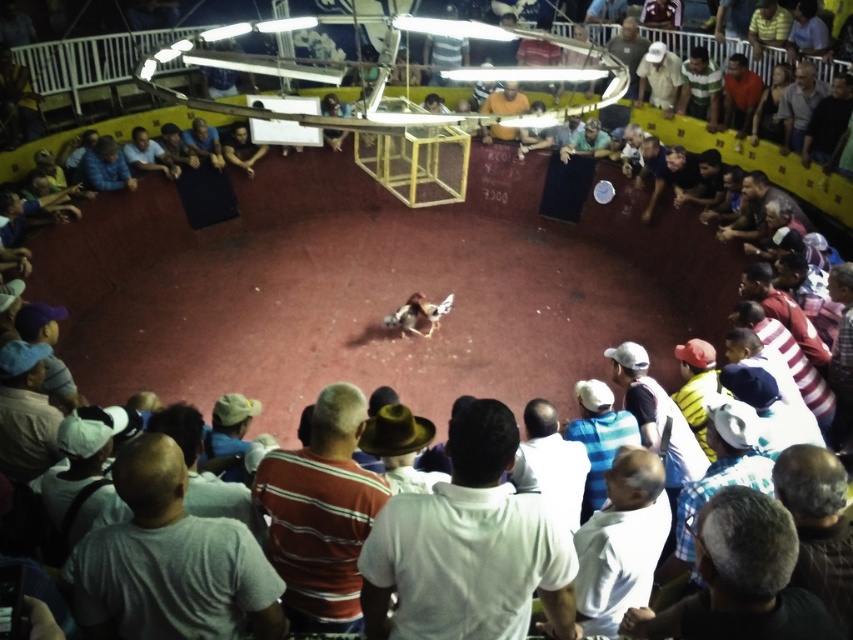
You are a photographer at the cockfighting arena. You need to take a photo of both the matte blue shirt at upper right and the blue shirt at upper left. Which shirt should you focus on first to ensure it appears larger in the photo?

The matte blue shirt at upper right should be focused on first because it is larger in size than the blue shirt at upper left, ensuring it will appear bigger in the photo.

You are standing at the edge of the cockfighting arena and want to greet the person wearing the green striped shirt at upper right. Considering the arena has a diameter of 8 meters, can you walk directly to them without entering the fighting area?

The distance between you and the green striped shirt at upper right is 7.95 meters. Since the arena has an 8 meter diameter, you can walk to them without entering the fighting area as the distance is just under the arena size.

You are a photographer standing at the edge of the arena. You want to take a photo of both point (688, 64) and point (740, 132) in the same frame. Which point is closer to your camera lens?

Point (688, 64) is closer to the camera lens because it is further to the viewer than point (740, 132).